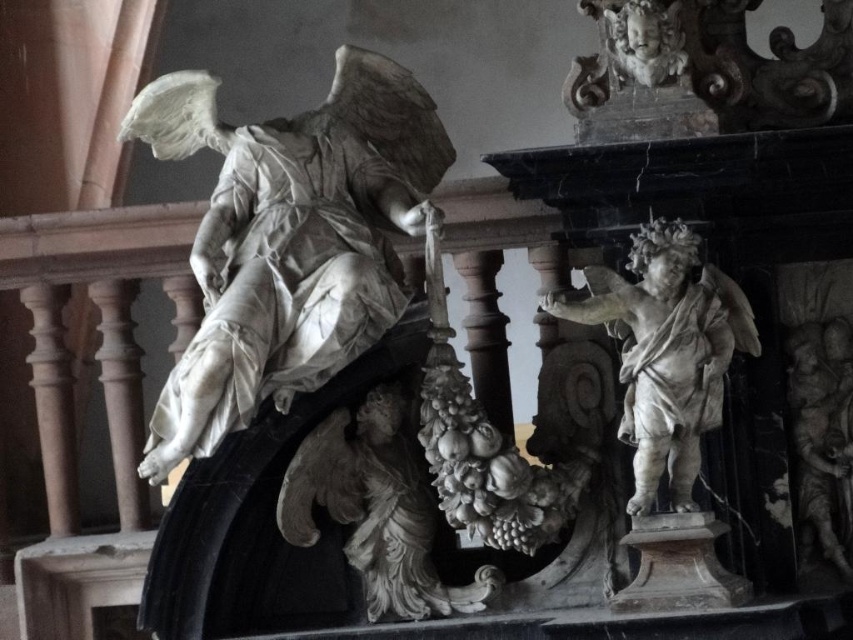
You are an architect examining the intricate details of this ornate structure. You notice the white marble grapes at center and the smooth gray cherub at right. Which object is taller?

The smooth gray cherub at right is taller than the white marble grapes at center.

You are an art restorer examining the architectural structure. You need to clean both the white marble cherub at center and the white marble cherub at upper right. Which cherub will require you to use a ladder to reach?

The white marble cherub at upper right will require a ladder because it is further away from the viewer compared to the white marble cherub at center, meaning it is positioned higher up.